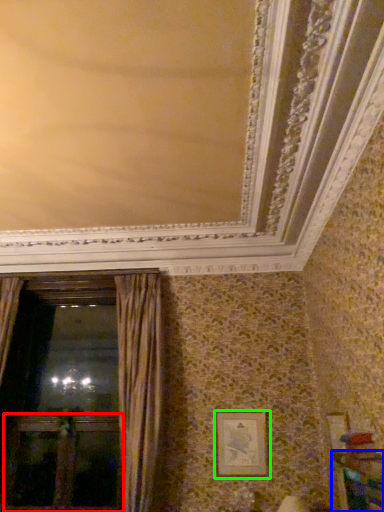
Question: Considering the real-world distances, which object is closest to screen door (highlighted by a red box)? furniture (highlighted by a blue box) or picture frame (highlighted by a green box).

Choices:
 (A) furniture
 (B) picture frame

Answer: (B)